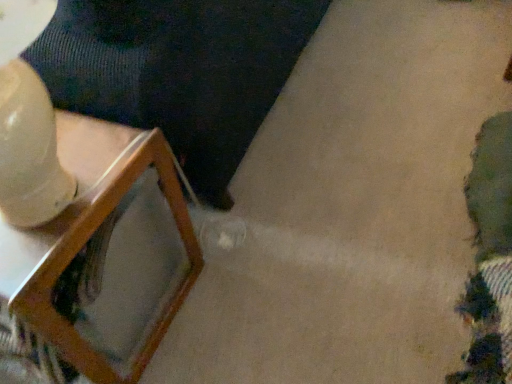
What do you see at coordinates (98, 262) in the screenshot? I see `wooden frame at left` at bounding box center [98, 262].

Measure the distance between point (133, 131) and camera.

Point (133, 131) is 33.62 inches away from camera.

I want to click on wooden frame at left, so click(x=98, y=262).

Identify the location of wooden frame at left. (98, 262).